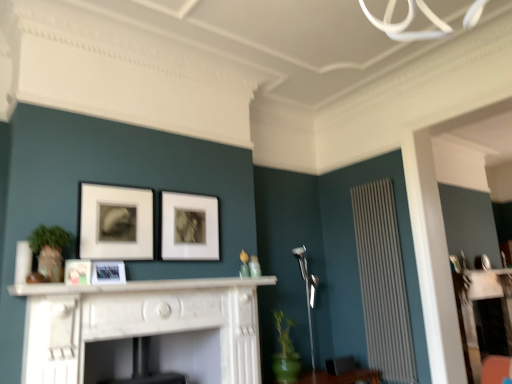
Identify the location of white glossy picture frame at center, the first picture frame viewed from the left. The height and width of the screenshot is (384, 512). (77, 272).

How much space does matte white picture frame at upper left, which is counted as the third picture frame, starting from the left, occupy vertically?

It is 20.99 inches.

This screenshot has height=384, width=512. Identify the location of white marble fireplace at center. (139, 286).

Where is `white glossy picture frame at center, marked as the fourth picture frame in a right-to-left arrangement`? The image size is (512, 384). white glossy picture frame at center, marked as the fourth picture frame in a right-to-left arrangement is located at coordinates (77, 272).

Considering the sizes of objects white glossy picture frame at center, marked as the fourth picture frame in a right-to-left arrangement, and white marble fireplace at center in the image provided, who is bigger, white glossy picture frame at center, marked as the fourth picture frame in a right-to-left arrangement, or white marble fireplace at center?

white marble fireplace at center.

Considering the positions of objects white glossy picture frame at center, marked as the fourth picture frame in a right-to-left arrangement, and white marble fireplace at center in the image provided, who is more to the right, white glossy picture frame at center, marked as the fourth picture frame in a right-to-left arrangement, or white marble fireplace at center?

white marble fireplace at center is more to the right.

Does white glossy picture frame at center, the first picture frame viewed from the left, have a lesser height compared to white marble fireplace at center?

Yes.

Would you say white glossy picture frame at center, marked as the fourth picture frame in a right-to-left arrangement, is inside or outside white marble fireplace at center?

white glossy picture frame at center, marked as the fourth picture frame in a right-to-left arrangement, is spatially situated outside white marble fireplace at center.

Who is smaller, white textured radiator at right or white glossy picture frame at center, the first picture frame viewed from the left?

white glossy picture frame at center, the first picture frame viewed from the left, is smaller.

Does white textured radiator at right have a greater height compared to white glossy picture frame at center, the first picture frame viewed from the left?

Indeed, white textured radiator at right has a greater height compared to white glossy picture frame at center, the first picture frame viewed from the left.

From a real-world perspective, does white textured radiator at right sit lower than white glossy picture frame at center, the first picture frame viewed from the left?

Indeed, from a real-world perspective, white textured radiator at right is positioned beneath white glossy picture frame at center, the first picture frame viewed from the left.

Could you tell me if white textured radiator at right is turned towards white glossy picture frame at center, marked as the fourth picture frame in a right-to-left arrangement?

Yes, white textured radiator at right is facing white glossy picture frame at center, marked as the fourth picture frame in a right-to-left arrangement.

Considering the sizes of objects matte black picture frame at center, positioned as the 1th picture frame in right-to-left order, and matte white picture frame at upper left, positioned as the second picture frame in right-to-left order, in the image provided, who is bigger, matte black picture frame at center, positioned as the 1th picture frame in right-to-left order, or matte white picture frame at upper left, positioned as the second picture frame in right-to-left order,?

With larger size is matte black picture frame at center, positioned as the 1th picture frame in right-to-left order.

Is point (218, 244) less distant than point (133, 249)?

No, (218, 244) is further to viewer.

Find the location of a particular element. This screenshot has height=384, width=512. picture frame behind the matte white picture frame at upper left, which is counted as the third picture frame, starting from the left is located at coordinates (189, 227).

Is white marble fireplace at center positioned before white glossy picture frame at center, the first picture frame viewed from the left?

Yes, white marble fireplace at center is closer to the viewer.

From the image's perspective, which one is positioned higher, white marble fireplace at center or white glossy picture frame at center, the first picture frame viewed from the left?

white glossy picture frame at center, the first picture frame viewed from the left, from the image's perspective.

From a real-world perspective, is white marble fireplace at center on top of white glossy picture frame at center, marked as the fourth picture frame in a right-to-left arrangement?

Actually, white marble fireplace at center is physically below white glossy picture frame at center, marked as the fourth picture frame in a right-to-left arrangement, in the real world.

Is matte white picture frame at center, placed as the second picture frame when sorted from left to right, positioned with its back to white glossy picture frame at center, marked as the fourth picture frame in a right-to-left arrangement?

No, matte white picture frame at center, placed as the second picture frame when sorted from left to right, is not facing the opposite direction of white glossy picture frame at center, marked as the fourth picture frame in a right-to-left arrangement.

How many degrees apart are the facing directions of matte white picture frame at center, placed as the second picture frame when sorted from left to right, and white glossy picture frame at center, the first picture frame viewed from the left?

20.5 degrees.

Would you say matte white picture frame at center, placed as the second picture frame when sorted from left to right, is a long distance from white glossy picture frame at center, the first picture frame viewed from the left?

That's not correct — matte white picture frame at center, placed as the second picture frame when sorted from left to right, is a little close to white glossy picture frame at center, the first picture frame viewed from the left.

Considering the sizes of objects matte white picture frame at center, placed as the second picture frame when sorted from left to right, and white glossy picture frame at center, marked as the fourth picture frame in a right-to-left arrangement, in the image provided, who is bigger, matte white picture frame at center, placed as the second picture frame when sorted from left to right, or white glossy picture frame at center, marked as the fourth picture frame in a right-to-left arrangement,?

matte white picture frame at center, placed as the second picture frame when sorted from left to right.

Who is more distant, white marble fireplace at center or matte white picture frame at center, placed as the second picture frame when sorted from left to right?

matte white picture frame at center, placed as the second picture frame when sorted from left to right, is further away from the camera.

Considering the points (191, 284) and (109, 271), which point is behind, point (191, 284) or point (109, 271)?

Positioned behind is point (191, 284).

Looking at their sizes, would you say white marble fireplace at center is wider or thinner than matte white picture frame at center, the third picture frame in the right-to-left sequence?

white marble fireplace at center is wider than matte white picture frame at center, the third picture frame in the right-to-left sequence.

Who is smaller, matte white picture frame at center, the third picture frame in the right-to-left sequence, or white marble fireplace at center?

Smaller between the two is matte white picture frame at center, the third picture frame in the right-to-left sequence.

In the scene shown: Measure the distance between matte white picture frame at center, the third picture frame in the right-to-left sequence, and white marble fireplace at center.

They are 10.97 inches apart.

From the image's perspective, does matte white picture frame at center, the third picture frame in the right-to-left sequence, appear higher than white marble fireplace at center?

Correct, matte white picture frame at center, the third picture frame in the right-to-left sequence, appears higher than white marble fireplace at center in the image.

Considering the relative positions of matte white picture frame at center, placed as the second picture frame when sorted from left to right, and white marble fireplace at center in the image provided, is matte white picture frame at center, placed as the second picture frame when sorted from left to right, to the left or to the right of white marble fireplace at center?

From the image, it's evident that matte white picture frame at center, placed as the second picture frame when sorted from left to right, is to the left of white marble fireplace at center.

Identify the location of fireplace lying in front of the white glossy picture frame at center, marked as the fourth picture frame in a right-to-left arrangement. pos(138,322).

In the image, there is a white glossy picture frame at center, the first picture frame viewed from the left. At what (x,y) coordinates should I click in order to perform the action: click on radiator below it (from the image's perspective). Please return your answer as a coordinate pair (x, y). Looking at the image, I should click on (383, 282).

Estimate the real-world distances between objects in this image. Which object is further from matte white picture frame at upper left, positioned as the second picture frame in right-to-left order, white glossy picture frame at center, the first picture frame viewed from the left, or white marble fireplace at center?

white marble fireplace at center is positioned further to the anchor matte white picture frame at upper left, positioned as the second picture frame in right-to-left order.

Based on their spatial positions, is white marble fireplace at center or white textured radiator at right closer to matte white picture frame at upper left, which is counted as the third picture frame, starting from the left?

The object closer to matte white picture frame at upper left, which is counted as the third picture frame, starting from the left, is white marble fireplace at center.

Which object lies nearer to the anchor point white marble fireplace at center, matte white picture frame at center, placed as the second picture frame when sorted from left to right, or matte white picture frame at upper left, positioned as the second picture frame in right-to-left order?

Based on the image, matte white picture frame at center, placed as the second picture frame when sorted from left to right, appears to be nearer to white marble fireplace at center.

Which object lies nearer to the anchor point white glossy picture frame at center, the first picture frame viewed from the left, white marble fireplace at center or white marble fireplace at center?

white marble fireplace at center is positioned closer to the anchor white glossy picture frame at center, the first picture frame viewed from the left.

When comparing their distances from matte black picture frame at center, positioned as the 1th picture frame in right-to-left order, does white textured radiator at right or matte white picture frame at upper left, which is counted as the third picture frame, starting from the left, seem further?

white textured radiator at right is positioned further to the anchor matte black picture frame at center, positioned as the 1th picture frame in right-to-left order.

When comparing their distances from matte white picture frame at center, the third picture frame in the right-to-left sequence, does matte black picture frame at center, arranged as the 4th picture frame when viewed from the left, or white marble fireplace at center seem further?

matte black picture frame at center, arranged as the 4th picture frame when viewed from the left, is further to matte white picture frame at center, the third picture frame in the right-to-left sequence.

Looking at the image, which one is located closer to matte black picture frame at center, positioned as the 1th picture frame in right-to-left order, white marble fireplace at center or white glossy picture frame at center, marked as the fourth picture frame in a right-to-left arrangement?

white marble fireplace at center is closer to matte black picture frame at center, positioned as the 1th picture frame in right-to-left order.

Looking at the image, which one is located further to matte white picture frame at upper left, which is counted as the third picture frame, starting from the left, white marble fireplace at center or white marble fireplace at center?

white marble fireplace at center lies further to matte white picture frame at upper left, which is counted as the third picture frame, starting from the left, than the other object.

Where is `picture frame between white marble fireplace at center and white textured radiator at right from left to right`? picture frame between white marble fireplace at center and white textured radiator at right from left to right is located at coordinates (189, 227).

Find the location of a particular element. mantle positioned between white marble fireplace at center and matte black picture frame at center, positioned as the 1th picture frame in right-to-left order, from near to far is located at coordinates (139, 286).

The height and width of the screenshot is (384, 512). In order to click on mantle between white marble fireplace at center and matte white picture frame at center, placed as the second picture frame when sorted from left to right, from front to back in this screenshot , I will do `click(139, 286)`.

Image resolution: width=512 pixels, height=384 pixels. In order to click on picture frame located between white marble fireplace at center and matte white picture frame at center, the third picture frame in the right-to-left sequence, in the depth direction in this screenshot , I will do `click(77, 272)`.